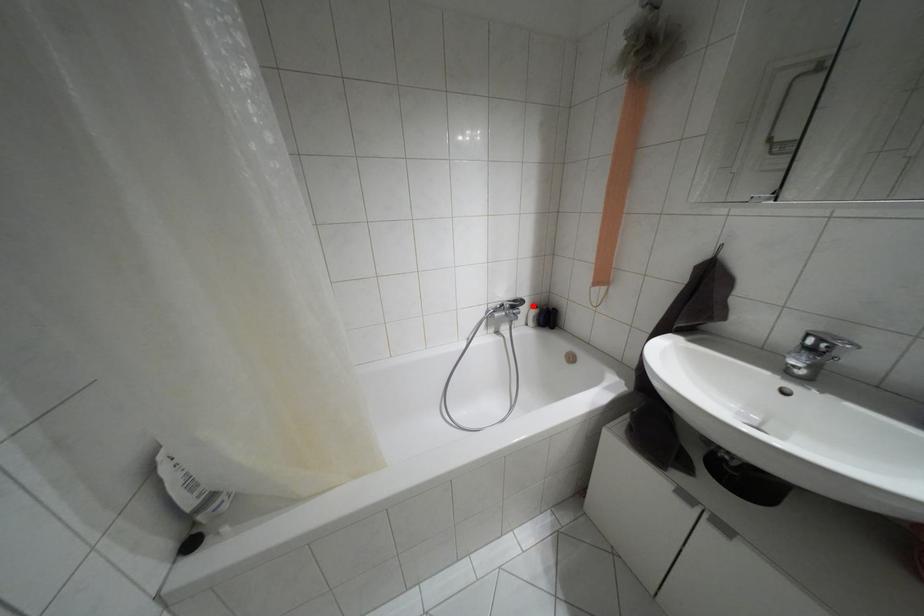
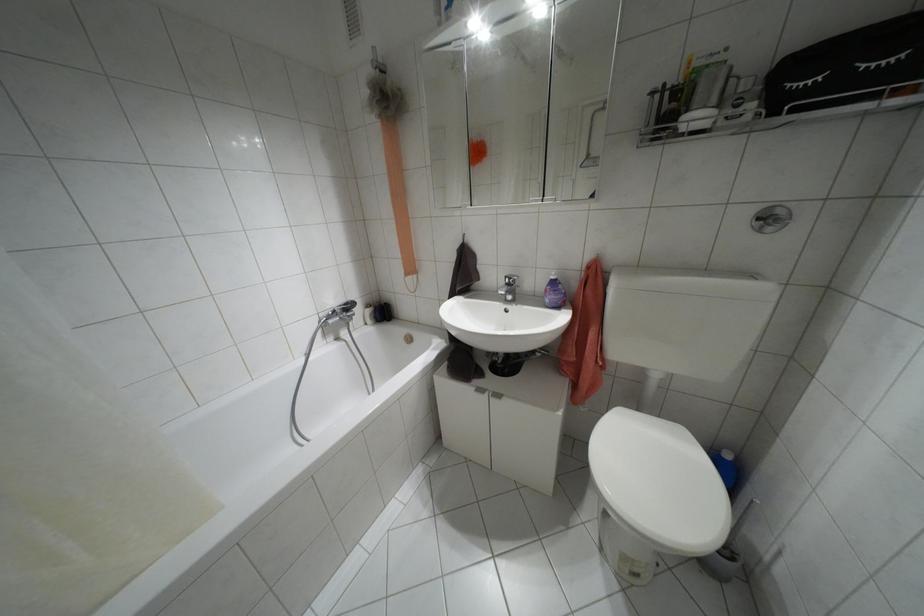
Locate, in the second image, the point that corresponds to the highlighted location in the first image.

(367, 305)